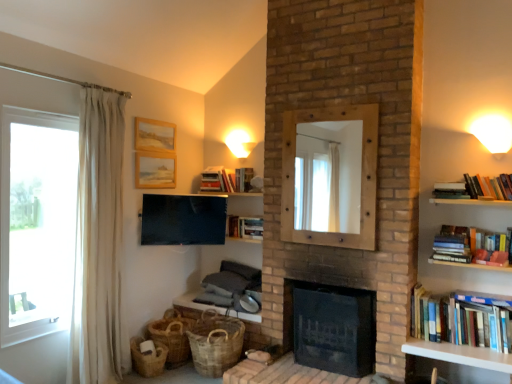
Identify the location of blank space situated above wooden mirror at center, arranged as the first fireplace when viewed from the top (from a real-world perspective). (328, 109).